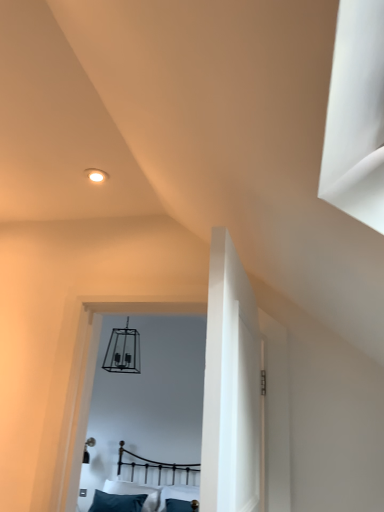
Question: Is metallic black bed at center bigger than teal fabric pillow at lower center?

Choices:
 (A) no
 (B) yes

Answer: (B)

Question: Is metallic black bed at center looking in the opposite direction of teal fabric pillow at lower center?

Choices:
 (A) yes
 (B) no

Answer: (B)

Question: From the image's perspective, is metallic black bed at center below teal fabric pillow at lower center?

Choices:
 (A) yes
 (B) no

Answer: (B)

Question: Considering the relative sizes of metallic black bed at center and teal fabric pillow at lower center in the image provided, is metallic black bed at center shorter than teal fabric pillow at lower center?

Choices:
 (A) no
 (B) yes

Answer: (A)

Question: From the image's perspective, is metallic black bed at center over teal fabric pillow at lower center?

Choices:
 (A) yes
 (B) no

Answer: (A)

Question: Is metallic black bed at center at the right side of teal fabric pillow at lower center?

Choices:
 (A) yes
 (B) no

Answer: (A)

Question: Is teal fabric pillow at lower center looking in the opposite direction of metallic black bed at center?

Choices:
 (A) yes
 (B) no

Answer: (A)

Question: Is teal fabric pillow at lower center completely or partially outside of metallic black bed at center?

Choices:
 (A) no
 (B) yes

Answer: (A)

Question: Is teal fabric pillow at lower center at the right side of metallic black bed at center?

Choices:
 (A) yes
 (B) no

Answer: (B)

Question: Is teal fabric pillow at lower center smaller than metallic black bed at center?

Choices:
 (A) yes
 (B) no

Answer: (A)

Question: Does teal fabric pillow at lower center have a larger size compared to metallic black bed at center?

Choices:
 (A) no
 (B) yes

Answer: (A)

Question: Are teal fabric pillow at lower center and metallic black bed at center making contact?

Choices:
 (A) no
 (B) yes

Answer: (A)

Question: Relative to teal fabric pillow at lower center, is metallic black bed at center in front or behind?

Choices:
 (A) front
 (B) behind

Answer: (A)